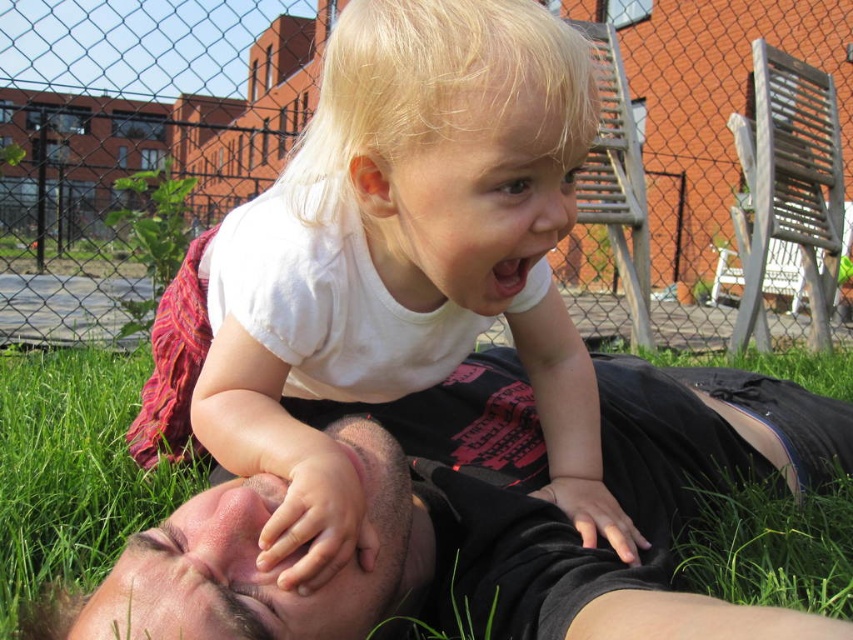
Question: Is white matte/t-shirt at upper center in front of black fabric at center?

Choices:
 (A) yes
 (B) no

Answer: (B)

Question: Observing the image, what is the correct spatial positioning of white matte/t-shirt at upper center in reference to black fabric at center?

Choices:
 (A) above
 (B) below

Answer: (A)

Question: Is white matte/t-shirt at upper center further to the viewer compared to black fabric at center?

Choices:
 (A) no
 (B) yes

Answer: (B)

Question: Which point is closer to the camera?

Choices:
 (A) black fabric at center
 (B) white matte/t-shirt at upper center

Answer: (A)